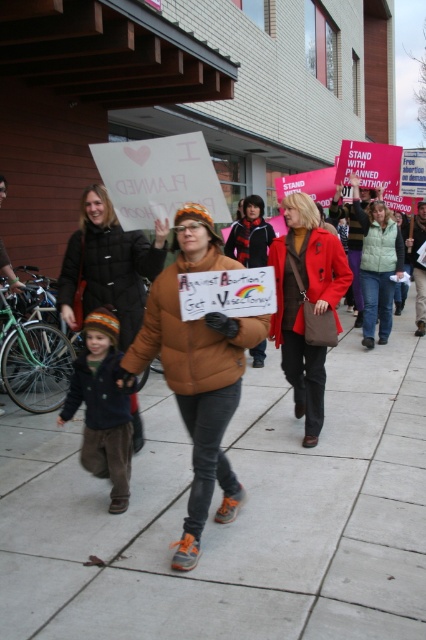
You are a photographer trying to capture the protest scene. You notice two protesters wearing brown jackets at the center of the image. Which one, the brown puffy jacket at center or the matte brown coat at center, is located to the left?

The brown puffy jacket at center is positioned on the left side of matte brown coat at center, so the brown puffy jacket at center is located to the left.

Based on the photo, you are a photographer standing at the edge of the protest. You want to take a photo that includes both the brown puffy jacket at center and the matte brown coat at center. What is the minimum distance you need to step back to ensure both are in frame?

The minimum distance you need to step back is 1.50 meters to include both the brown puffy jacket at center and the matte brown coat at center in the photo.